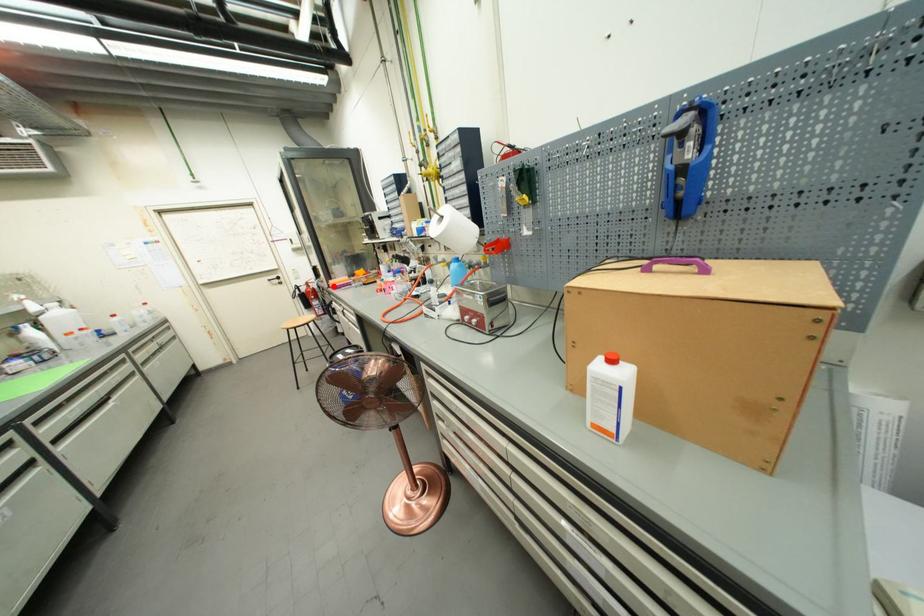
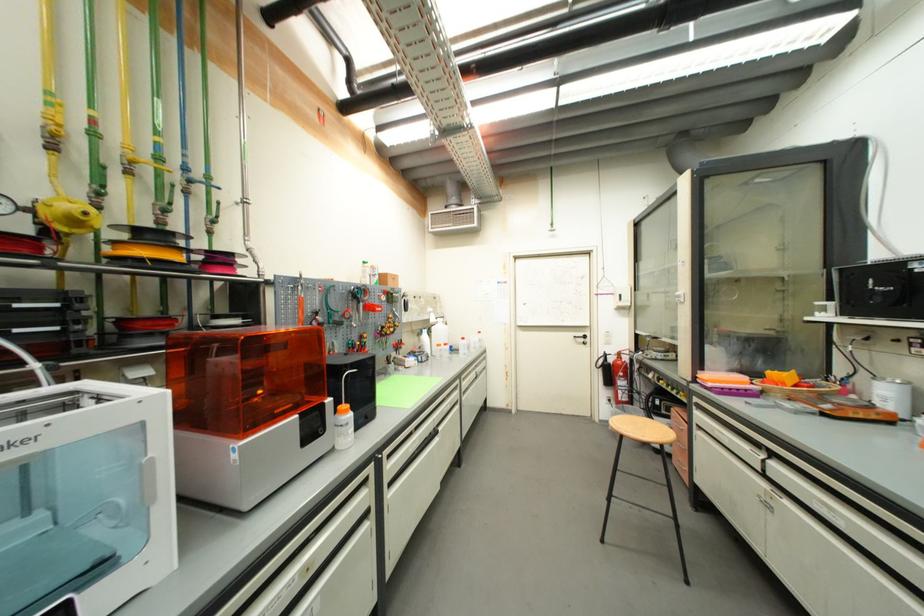
Locate, in the second image, the point that corresponds to the highlighted location in the first image.

(699, 379)